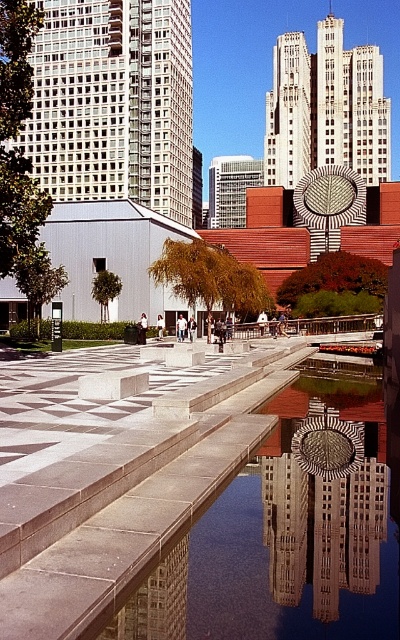
You are standing at the entrance of the plaza and want to reach the smooth concrete waterway at center. According to the plaza layout, which direction should you head towards from your current position?

The smooth concrete waterway at center is located at point (291, 529), which is towards the center of the plaza. You should head towards the center area to reach it.

You are a maintenance worker who needs to clean both the smooth concrete waterway at center and the reflective glass sculpture at center. Given that your cleaning equipment has a maximum reach of 14 inches, can you clean both objects without moving your position?

The distance between the smooth concrete waterway at center and the reflective glass sculpture at center is 13.98 inches, which is within the 14 inch reach of your equipment. Therefore, you can clean both objects without moving your position.